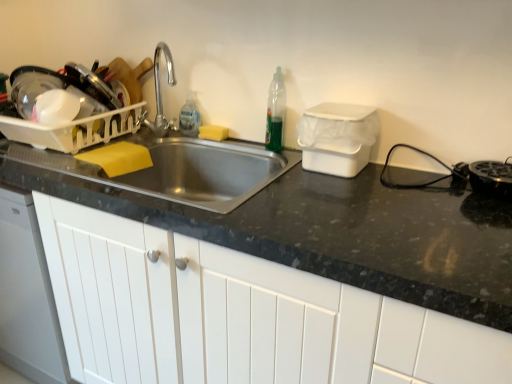
The height and width of the screenshot is (384, 512). What are the coordinates of `vacant position to the left of yellow sponge at sink` in the screenshot? It's located at (176, 135).